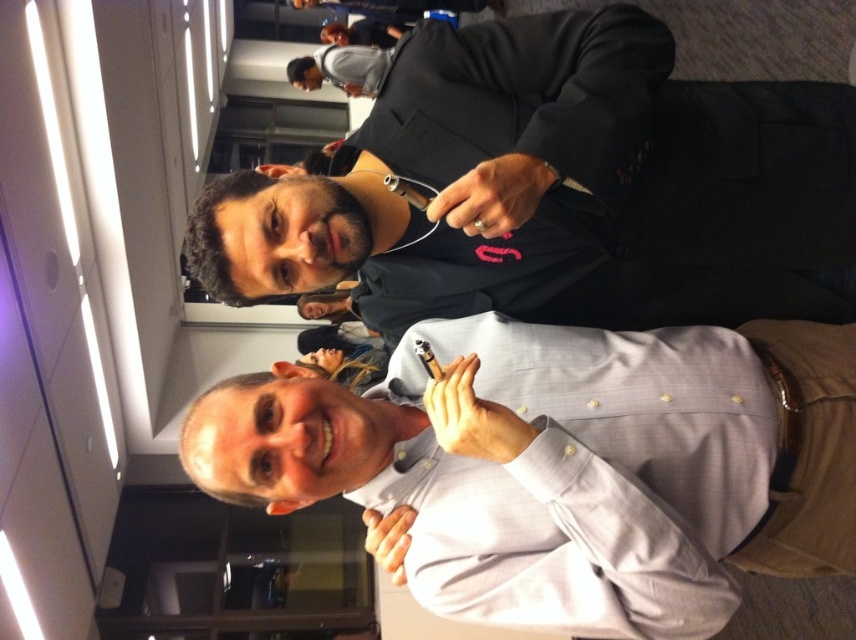
Is black matte suit at center positioned in front of white button-down shirt at center?

Yes, it is in front of white button-down shirt at center.

Is black matte suit at center below white button-down shirt at center?

Actually, black matte suit at center is above white button-down shirt at center.

Locate an element on the screen. The height and width of the screenshot is (640, 856). black matte suit at center is located at coordinates (556, 188).

Find the location of `black matte suit at center`. black matte suit at center is located at coordinates (556, 188).